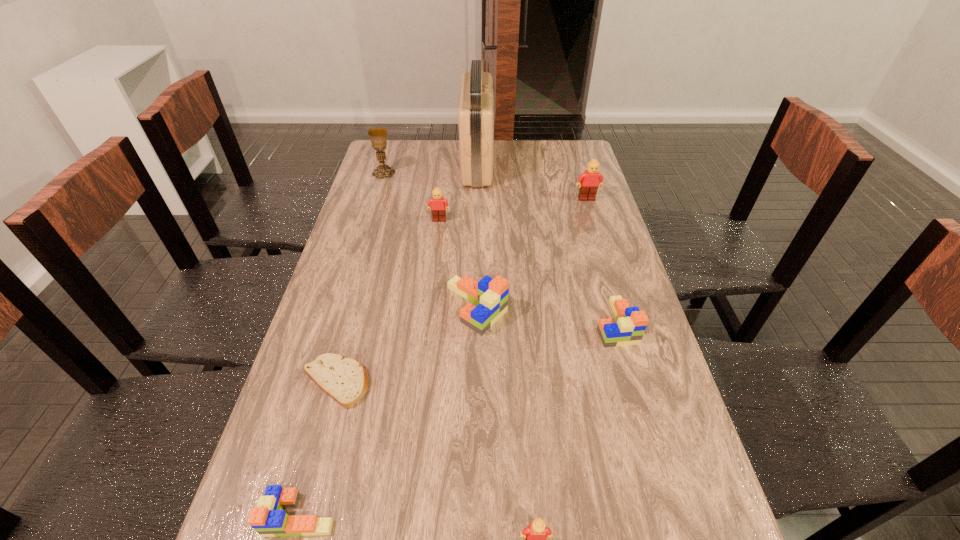
Identify the location of beige radio receiver. The image size is (960, 540). (475, 115).

This screenshot has width=960, height=540. I want to click on the tallest object, so click(x=475, y=115).

You are a GUI agent. You are given a task and a screenshot of the screen. Output one action in this format:
    pyautogui.click(x=<x>, y=<y>)
    Task: Click on the gold chalice
    The image size is (960, 540).
    Given the screenshot: What is the action you would take?
    pyautogui.click(x=378, y=136)

Identify the location of the farthest Lego. (589, 181).

You are a GUI agent. You are given a task and a screenshot of the screen. Output one action in this format:
    pyautogui.click(x=<x>, y=<y>)
    Task: Click on the farthest brown Lego
    
    Given the screenshot: What is the action you would take?
    pyautogui.click(x=589, y=181)

Identify the location of the second Lego from left to right. The image size is (960, 540). (438, 210).

At what (x,y) coordinates should I click in order to perform the action: click on the second farthest brown Lego. Please return your answer as a coordinate pair (x, y). This screenshot has width=960, height=540. Looking at the image, I should click on (438, 210).

Identify the location of the second orange Lego from right to left. (490, 295).

The width and height of the screenshot is (960, 540). I want to click on the second smallest orange Lego, so click(631, 324).

Identify the location of the smallest orange Lego. This screenshot has height=540, width=960. (268, 519).